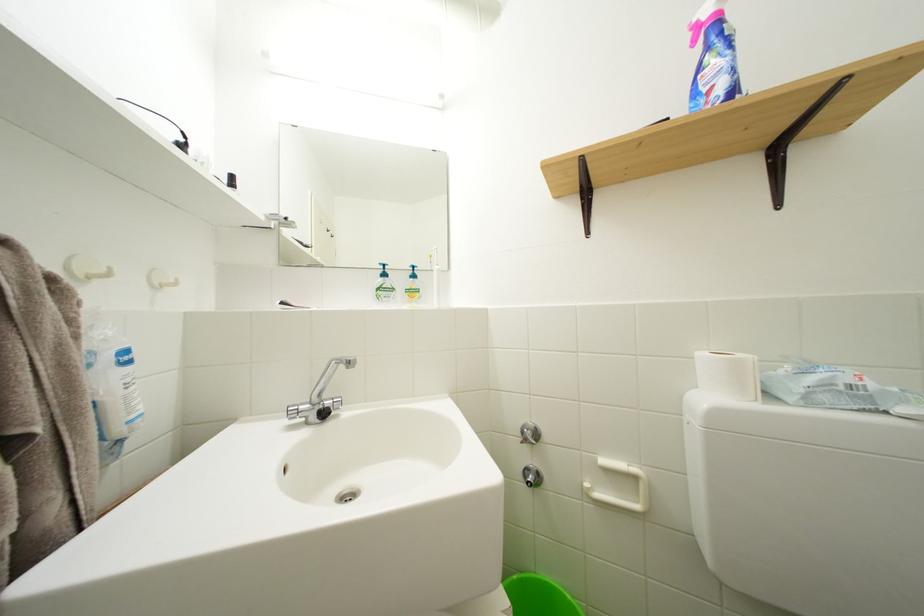
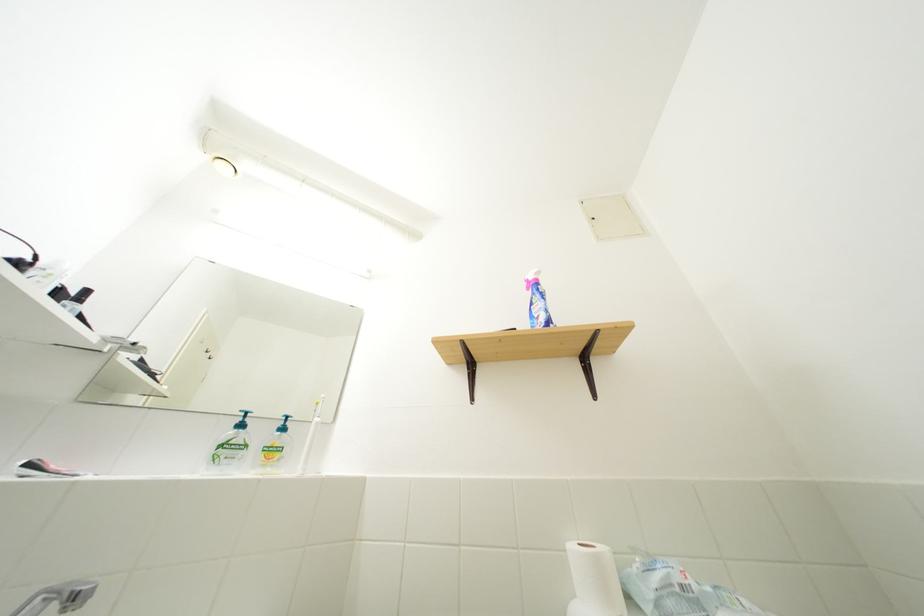
In the second image, find the point that corresponds to (439,308) in the first image.

(298, 474)